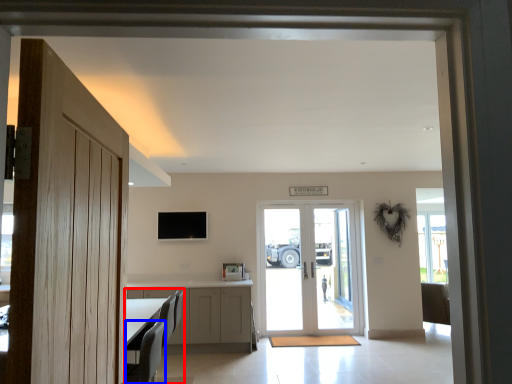
Question: Which object appears closest to the camera in this image, furniture (highlighted by a red box) or armchair (highlighted by a blue box)?

Choices:
 (A) furniture
 (B) armchair

Answer: (B)